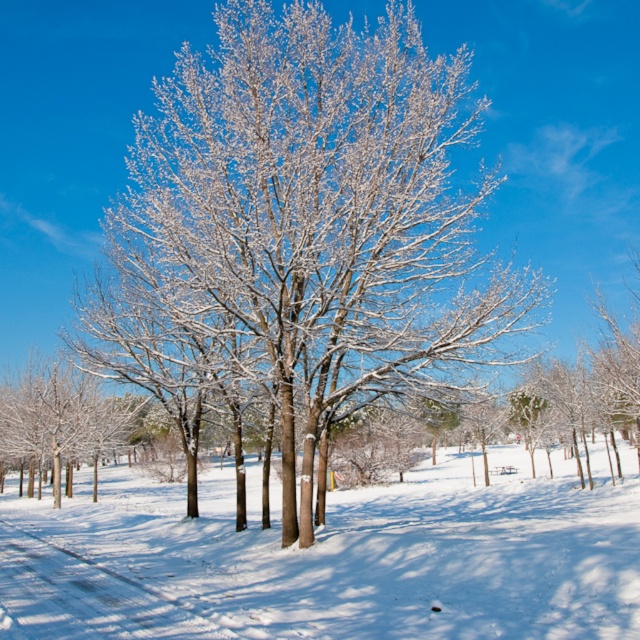
Question: Does snow-covered tree at center have a greater width compared to white snow-covered tree at left?

Choices:
 (A) yes
 (B) no

Answer: (A)

Question: Among these points, which one is nearest to the camera?

Choices:
 (A) (492, 595)
 (B) (29, 369)

Answer: (A)

Question: Is snow-covered tree at center behind white frosty snow at center?

Choices:
 (A) no
 (B) yes

Answer: (B)

Question: Which point is closer to the camera?

Choices:
 (A) snow-covered tree at center
 (B) white frosty snow at center
 (C) white snow-covered tree at left

Answer: (B)

Question: Can you confirm if snow-covered tree at center is bigger than white frosty snow at center?

Choices:
 (A) no
 (B) yes

Answer: (A)

Question: Which is nearer to the white frosty snow at center?

Choices:
 (A) snow-covered tree at center
 (B) white snow-covered tree at left

Answer: (A)